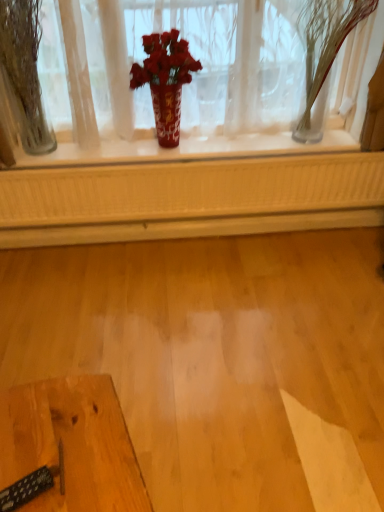
Question: Are clear glass vase at left, which is the 1th tree from left to right, and clear glass vase at upper right, acting as the 2th tree starting from the left, located far from each other?

Choices:
 (A) no
 (B) yes

Answer: (B)

Question: From the image's perspective, is clear glass vase at left, which ranks as the second tree in right-to-left order, over clear glass vase at upper right, acting as the 2th tree starting from the left?

Choices:
 (A) no
 (B) yes

Answer: (A)

Question: Does clear glass vase at left, which is the 1th tree from left to right, turn towards clear glass vase at upper right, which is the 1th tree in right-to-left order?

Choices:
 (A) no
 (B) yes

Answer: (A)

Question: Is clear glass vase at upper right, acting as the 2th tree starting from the left, completely or partially inside clear glass vase at left, which ranks as the second tree in right-to-left order?

Choices:
 (A) yes
 (B) no

Answer: (B)

Question: From a real-world perspective, is clear glass vase at left, which is the 1th tree from left to right, beneath clear glass vase at upper right, which is the 1th tree in right-to-left order?

Choices:
 (A) yes
 (B) no

Answer: (A)

Question: Are clear glass vase at left, which ranks as the second tree in right-to-left order, and clear glass vase at upper right, acting as the 2th tree starting from the left, making contact?

Choices:
 (A) yes
 (B) no

Answer: (B)

Question: From the image's perspective, is red glossy vase at center located beneath wooden table at lower left?

Choices:
 (A) no
 (B) yes

Answer: (A)

Question: Does red glossy vase at center have a greater height compared to wooden table at lower left?

Choices:
 (A) no
 (B) yes

Answer: (B)

Question: Is red glossy vase at center outside wooden table at lower left?

Choices:
 (A) no
 (B) yes

Answer: (B)

Question: Is red glossy vase at center in contact with wooden table at lower left?

Choices:
 (A) yes
 (B) no

Answer: (B)

Question: From a real-world perspective, is red glossy vase at center physically below wooden table at lower left?

Choices:
 (A) yes
 (B) no

Answer: (B)

Question: From the image's perspective, would you say red glossy vase at center is positioned over wooden table at lower left?

Choices:
 (A) no
 (B) yes

Answer: (B)

Question: From a real-world perspective, is clear glass vase at upper right, which is the 1th tree in right-to-left order, positioned over wooden table at lower left based on gravity?

Choices:
 (A) no
 (B) yes

Answer: (B)